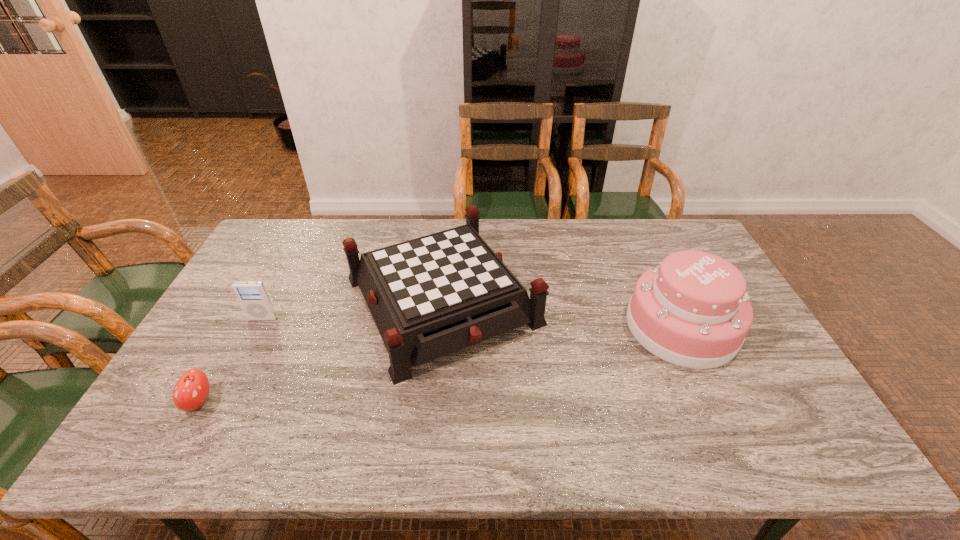
I want to click on empty space that is in between the cake and the checkerboard, so click(x=562, y=313).

Locate an element on the screen. The image size is (960, 540). blank region between the cake and the apple is located at coordinates (441, 364).

Image resolution: width=960 pixels, height=540 pixels. I want to click on empty space that is in between the rightmost object and the apple, so click(441, 364).

I want to click on blank region between the cake and the shortest object, so click(x=441, y=364).

Locate an element on the screen. This screenshot has height=540, width=960. free space that is in between the apple and the tallest object is located at coordinates (441, 364).

Image resolution: width=960 pixels, height=540 pixels. What are the coordinates of `free spot between the shortest object and the iPod` in the screenshot? It's located at (231, 360).

At what (x,y) coordinates should I click in order to perform the action: click on free area in between the third object from left to right and the iPod. Please return your answer as a coordinate pair (x, y). This screenshot has height=540, width=960. Looking at the image, I should click on (352, 309).

At what (x,y) coordinates should I click in order to perform the action: click on the closest object to the iPod. Please return your answer as a coordinate pair (x, y). Looking at the image, I should click on (431, 296).

This screenshot has width=960, height=540. What are the coordinates of `object that ranks as the third closest to the iPod` in the screenshot? It's located at pyautogui.click(x=692, y=310).

This screenshot has height=540, width=960. I want to click on vacant space that satisfies the following two spatial constraints: 1. on the back side of the rightmost object; 2. on the right side of the shortest object, so click(241, 326).